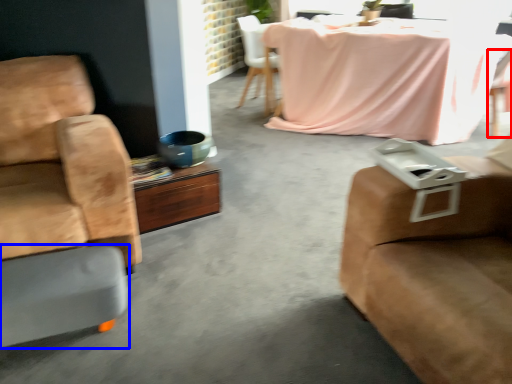
Question: Which object is further to the camera taking this photo, chair (highlighted by a red box) or footrest (highlighted by a blue box)?

Choices:
 (A) chair
 (B) footrest

Answer: (A)